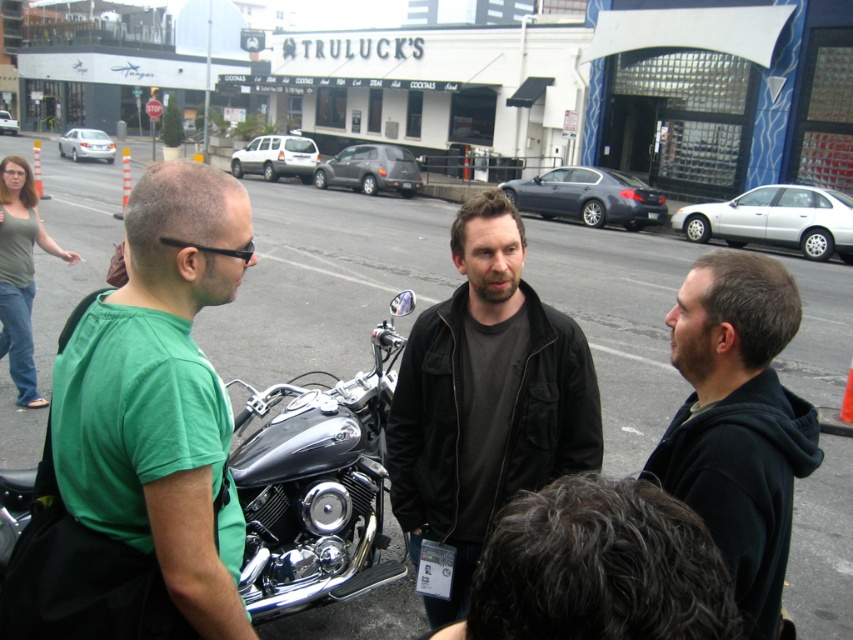
Is shiny chrome motorcycle at center smaller than black hoodie at right?

Actually, shiny chrome motorcycle at center might be larger than black hoodie at right.

Is point (73, 596) closer to camera compared to point (737, 301)?

Yes, it is in front of point (737, 301).

What are the coordinates of `shiny chrome motorcycle at center` in the screenshot? It's located at (317, 484).

Is point (140, 225) behind point (694, 468)?

No.

Who is higher up, green matte t-shirt at left or black hoodie at right?

green matte t-shirt at left is higher up.

Describe the element at coordinates (155, 419) in the screenshot. I see `green matte t-shirt at left` at that location.

This screenshot has height=640, width=853. In order to click on green matte t-shirt at left in this screenshot , I will do `click(155, 419)`.

Does dark gray fabric jacket at center appear on the left side of black hoodie at right?

Correct, you'll find dark gray fabric jacket at center to the left of black hoodie at right.

Does dark gray fabric jacket at center appear over black hoodie at right?

Incorrect, dark gray fabric jacket at center is not positioned above black hoodie at right.

Does point (408, 486) lie in front of point (761, 461)?

No, (408, 486) is behind (761, 461).

Identify the location of dark gray fabric jacket at center. [485, 397].